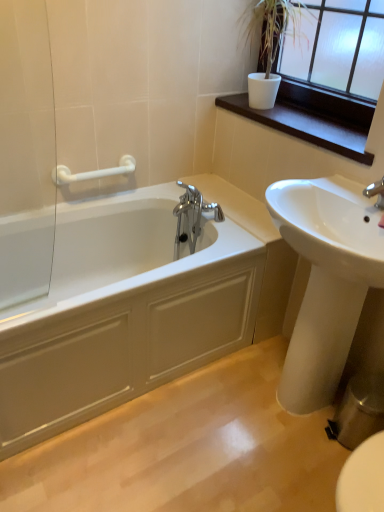
This screenshot has height=512, width=384. In order to click on vacant space situated above white plastic grab bar at upper left (from a real-world perspective) in this screenshot , I will do `click(93, 162)`.